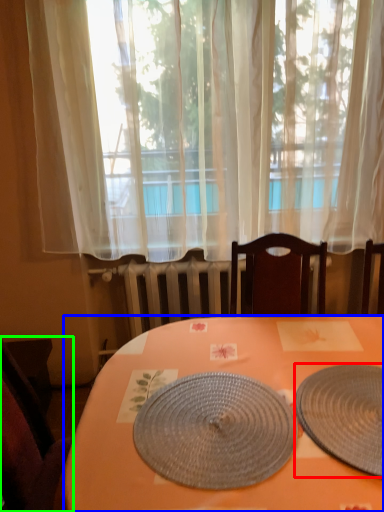
Question: Which is nearer to the plate (highlighted by a red box)? desk (highlighted by a blue box) or chair (highlighted by a green box).

Choices:
 (A) desk
 (B) chair

Answer: (A)